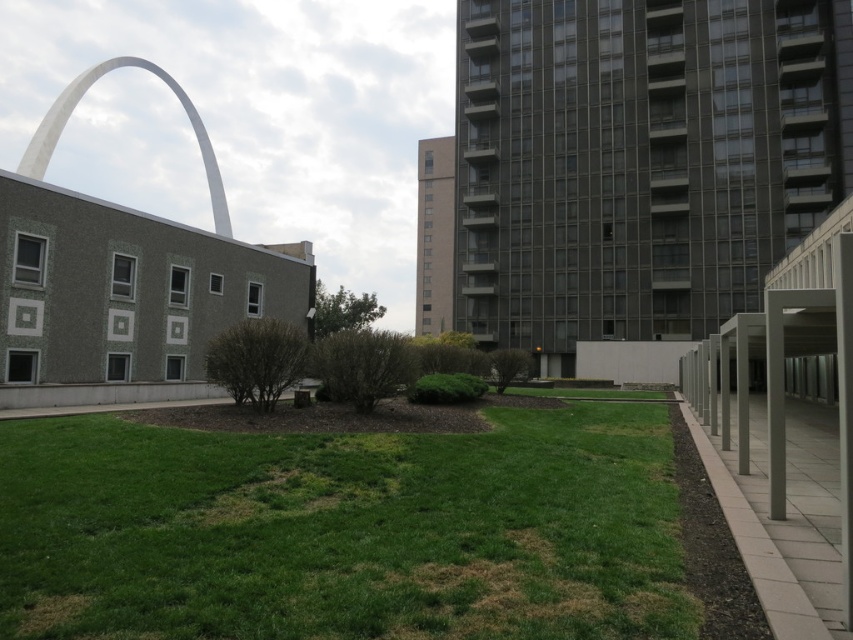
Is green grass at center above white smooth arch at upper left?

Incorrect, green grass at center is not positioned above white smooth arch at upper left.

Is point (421, 541) more distant than point (56, 132)?

No, it is in front of (56, 132).

Where is `green grass at center`? The height and width of the screenshot is (640, 853). green grass at center is located at coordinates (344, 531).